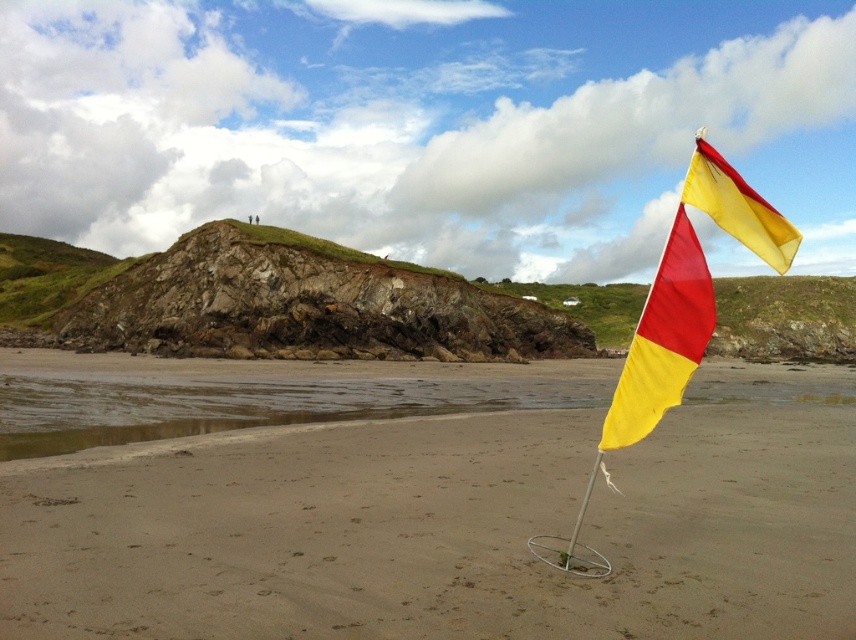
Does yellow fabric flag at center appear over yellow fabric flag at right?

Incorrect, yellow fabric flag at center is not positioned above yellow fabric flag at right.

Is yellow fabric flag at center wider than yellow fabric flag at right?

Yes.

At what (x,y) coordinates should I click in order to perform the action: click on yellow fabric flag at center. Please return your answer as a coordinate pair (x, y). Looking at the image, I should click on (415, 500).